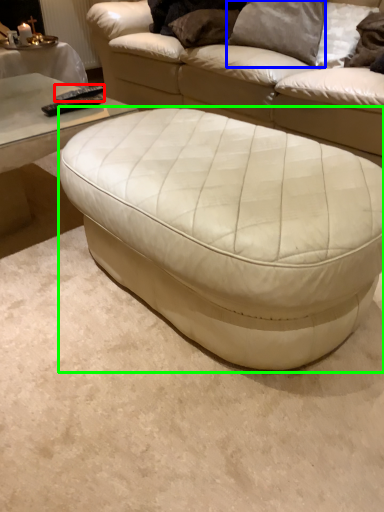
Question: Estimate the real-world distances between objects in this image. Which object is closer to remote (highlighted by a red box), pillow (highlighted by a blue box) or table (highlighted by a green box)?

Choices:
 (A) pillow
 (B) table

Answer: (B)